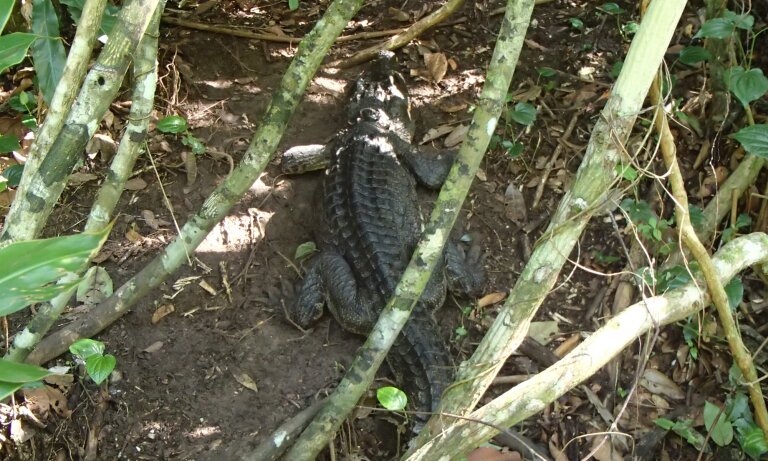
This screenshot has height=461, width=768. I want to click on right front leg, so click(425, 168).